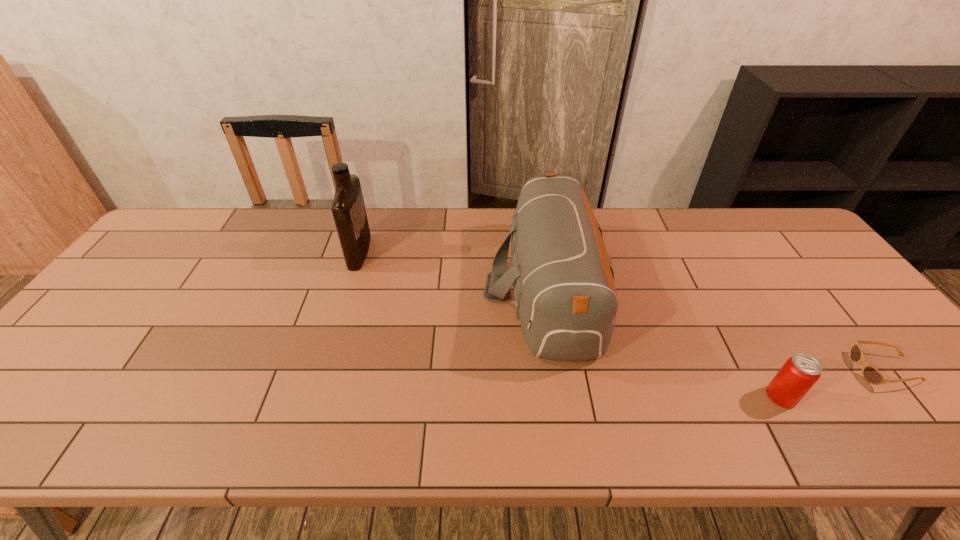
Locate an element on the screen. free space located on the left of the can is located at coordinates (704, 396).

Locate an element on the screen. free region located on the front-facing side of the sunglasses is located at coordinates (809, 370).

The image size is (960, 540). I want to click on free location located 0.120m on the front-facing side of the sunglasses, so (x=805, y=370).

Where is `free space located on the front-facing side of the sunglasses`? free space located on the front-facing side of the sunglasses is located at coordinates [725, 370].

At what (x,y) coordinates should I click in order to perform the action: click on liquor positioned at the far edge. Please return your answer as a coordinate pair (x, y). This screenshot has height=540, width=960. Looking at the image, I should click on (348, 208).

This screenshot has width=960, height=540. Identify the location of duffel bag located in the far edge section of the desktop. (565, 298).

Find the location of a particular element. object located at the near edge is located at coordinates (800, 372).

Find the location of a particular element. Image resolution: width=960 pixels, height=540 pixels. object at the right edge is located at coordinates (872, 375).

In the image, there is a desktop. At what (x,y) coordinates should I click in order to perform the action: click on free space at the far edge. Please return your answer as a coordinate pair (x, y). The image size is (960, 540). Looking at the image, I should click on (235, 231).

Find the location of a particular element. The height and width of the screenshot is (540, 960). blank space at the near edge of the desktop is located at coordinates (854, 444).